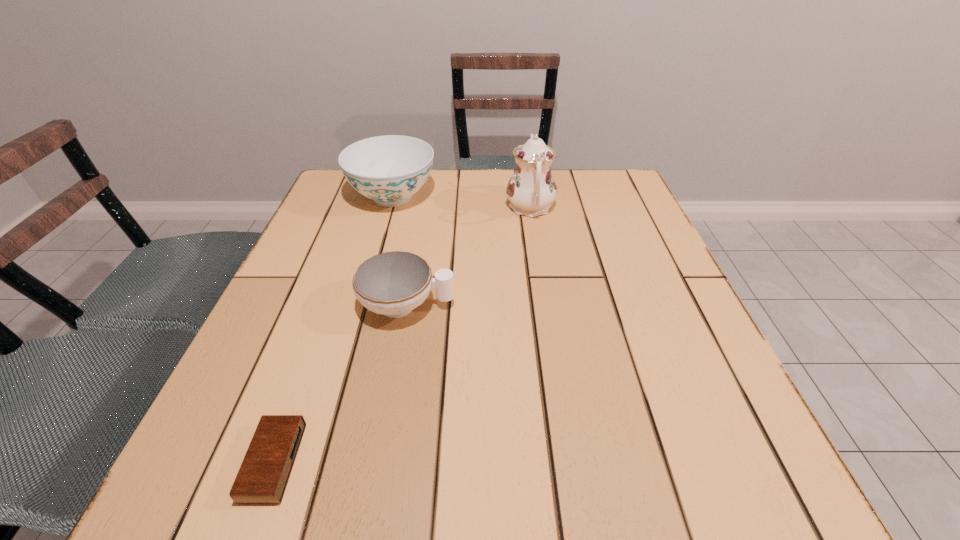
Locate an element on the screen. This screenshot has width=960, height=540. vacant space situated on the front face of the nearest object is located at coordinates (468, 462).

I want to click on object at the near edge, so click(x=263, y=476).

This screenshot has width=960, height=540. What are the coordinates of `chinaware that is at the left edge` in the screenshot? It's located at (389, 169).

Locate an element on the screen. This screenshot has width=960, height=540. alarm clock at the left edge is located at coordinates (263, 476).

Where is `object present at the far left corner`? Image resolution: width=960 pixels, height=540 pixels. object present at the far left corner is located at coordinates (389, 169).

At what (x,y) coordinates should I click in order to perform the action: click on object that is at the near left corner. Please return your answer as a coordinate pair (x, y). This screenshot has width=960, height=540. Looking at the image, I should click on (263, 476).

You are a GUI agent. You are given a task and a screenshot of the screen. Output one action in this format:
    pyautogui.click(x=<x>, y=<y>)
    Task: Click on the vacant space at the far edge of the desktop
    This screenshot has height=540, width=960.
    Given the screenshot: What is the action you would take?
    pyautogui.click(x=463, y=190)

I want to click on vacant space at the near edge, so click(420, 505).

The width and height of the screenshot is (960, 540). I want to click on vacant space at the left edge of the desktop, so click(306, 316).

The width and height of the screenshot is (960, 540). In order to click on vacant space at the right edge in this screenshot , I will do `click(663, 254)`.